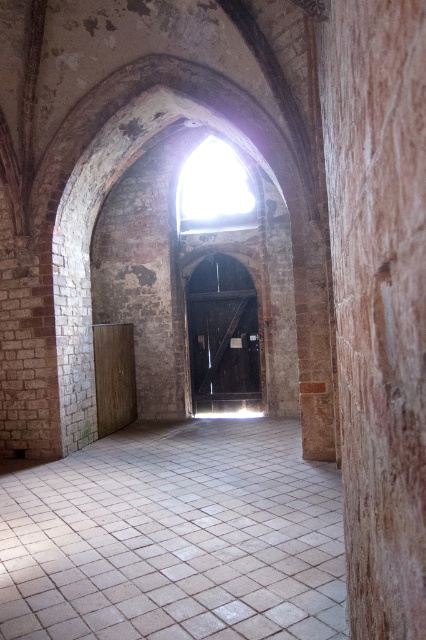
Between point (161, 545) and point (414, 477), which one is positioned in front?

Point (414, 477)

Is white tile floor at center to the left of brown polished wood pillar at right from the viewer's perspective?

Correct, you'll find white tile floor at center to the left of brown polished wood pillar at right.

What do you see at coordinates (175, 538) in the screenshot? This screenshot has height=640, width=426. I see `white tile floor at center` at bounding box center [175, 538].

Image resolution: width=426 pixels, height=640 pixels. I want to click on white tile floor at center, so click(175, 538).